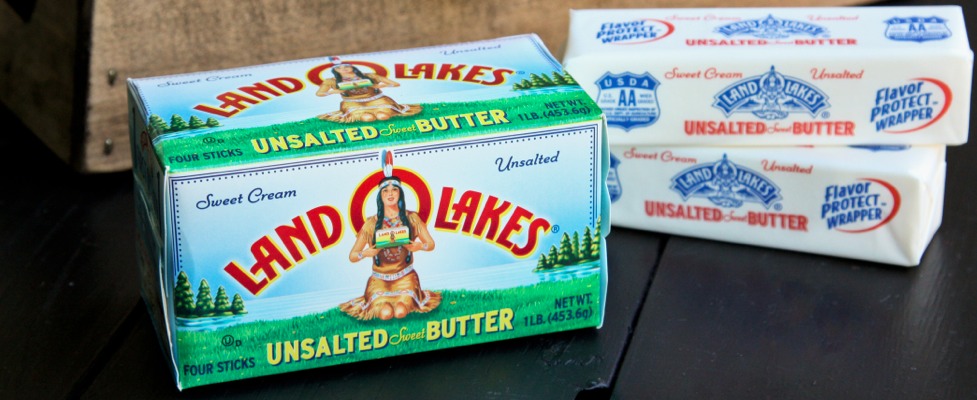
Identify the location of box. The height and width of the screenshot is (400, 977). (464, 252).